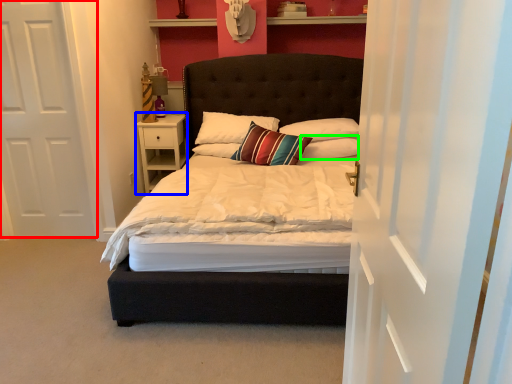
Question: Which is farther away from door (highlighted by a red box)? nightstand (highlighted by a blue box) or pillow (highlighted by a green box)?

Choices:
 (A) nightstand
 (B) pillow

Answer: (B)